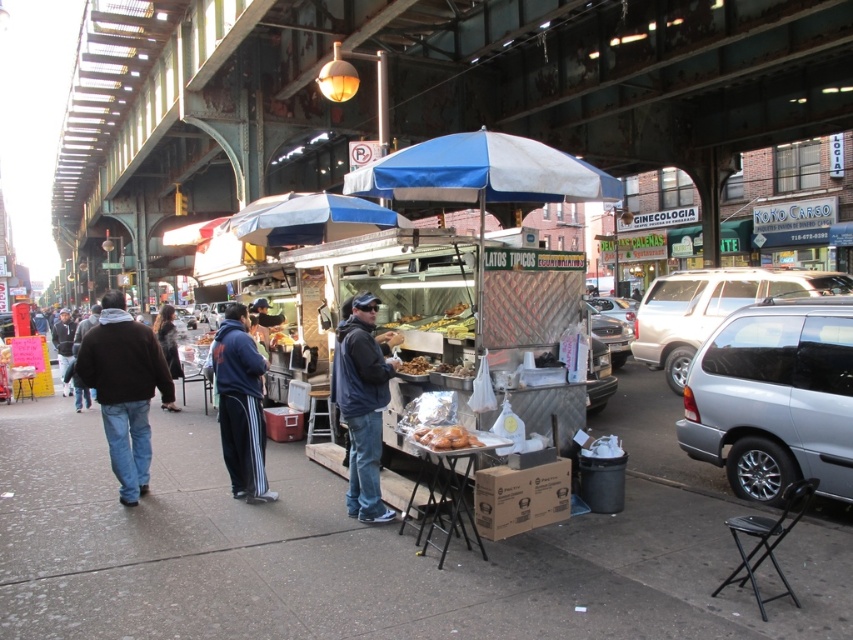
You are a customer standing at the food vendor stall with a blue and white umbrella. You see two people walking on the sidewalk to your left wearing a blue fleece jacket at center and a dark blue hoodie at center. Which one is closer to your left side?

The dark blue hoodie at center is closer to your left side because the blue fleece jacket at center is positioned on the right side of it.

You are a customer at the food vendor stall. You want to know if you can fit both the dark blue jacket at center and the golden crispy chicken at center into a shopping bag that can hold items up to 1 meter in width. Can you do this?

The dark blue jacket at center is wider than the golden crispy chicken at center. Since the shopping bag can hold items up to 1 meter in width, you need to ensure that the combined width of both items does not exceed this limit. However, without knowing the exact widths of each item, it is impossible to determine if they will fit together. You may need to check the individual widths of the dark blue jacket at center and the golden crispy chicken at center first.